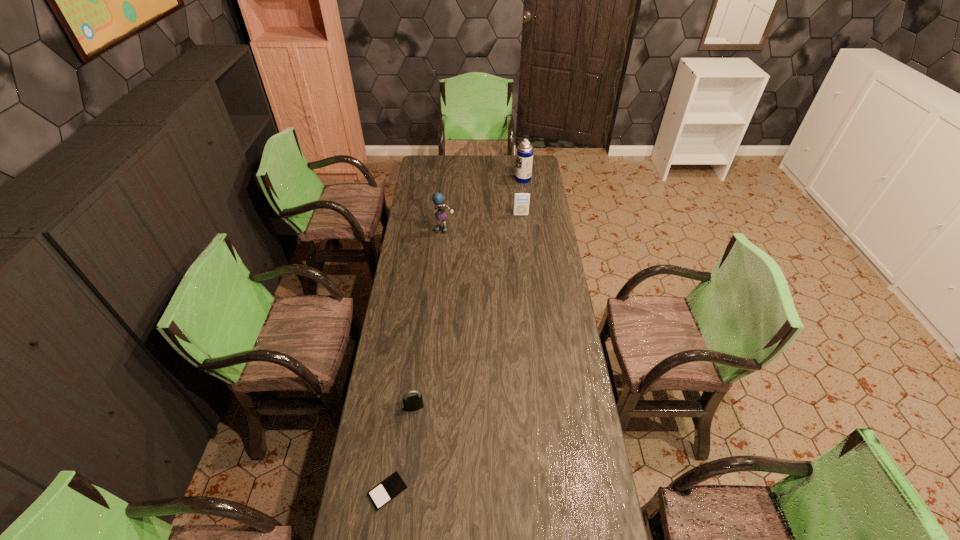
You are a GUI agent. You are given a task and a screenshot of the screen. Output one action in this format:
    pyautogui.click(x=<x>, y=<y>)
    Task: Click on the vacant region between the third nearest object and the shorter iPod
    The height and width of the screenshot is (540, 960).
    Given the screenshot: What is the action you would take?
    [x=416, y=361]

You are a GUI agent. You are given a task and a screenshot of the screen. Output one action in this format:
    pyautogui.click(x=<x>, y=<y>)
    Task: Click on the free space between the farthest object and the rag doll
    Image resolution: width=960 pixels, height=540 pixels.
    Given the screenshot: What is the action you would take?
    pyautogui.click(x=484, y=205)

Locate an element on the screen. The image size is (960, 540). vacant region between the padlock and the third tallest object is located at coordinates (468, 311).

Where is `object that is the second nearest to the taller iPod`? The image size is (960, 540). object that is the second nearest to the taller iPod is located at coordinates (438, 199).

Identify which object is the closest to the second shortest object. Please provide its 2D coordinates. Your answer should be formatted as a tuple, i.e. [(x, y)], where the tuple contains the x and y coordinates of a point satisfying the conditions above.

[(390, 488)]

Find the location of `vacant position in the image that satisfies the following two spatial constraints: 1. on the label side of the aerosol can; 2. on the front-facing side of the taller iPod`. vacant position in the image that satisfies the following two spatial constraints: 1. on the label side of the aerosol can; 2. on the front-facing side of the taller iPod is located at coordinates (528, 215).

At what (x,y) coordinates should I click in order to perform the action: click on free location that satisfies the following two spatial constraints: 1. on the label side of the aerosol can; 2. on the front side of the nearest object. Please return your answer as a coordinate pair (x, y). This screenshot has width=960, height=540. Looking at the image, I should click on (563, 491).